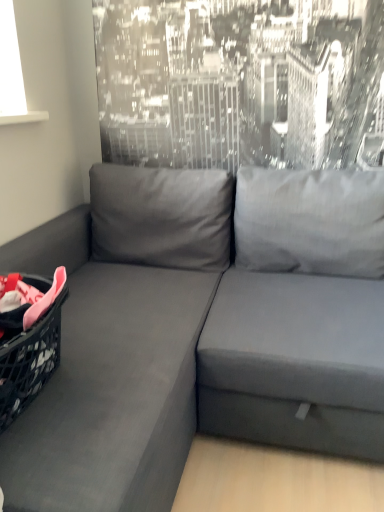
Locate an element on the screen. This screenshot has width=384, height=512. plastic black laundry basket at left is located at coordinates (29, 360).

What do you see at coordinates (29, 360) in the screenshot? I see `plastic black laundry basket at left` at bounding box center [29, 360].

What is the approximate width of suede gray couch at left?

It is 80.16 centimeters.

Measure the distance between suede gray couch at left and camera.

83.00 centimeters.

What do you see at coordinates (182, 348) in the screenshot? The image size is (384, 512). I see `suede gray couch at left` at bounding box center [182, 348].

Where is `suede gray couch at left`? suede gray couch at left is located at coordinates (182, 348).

Identify the location of plastic black laundry basket at left. (29, 360).

Which object is positioned more to the left, suede gray couch at left or plastic black laundry basket at left?

plastic black laundry basket at left.

Is suede gray couch at left further to camera compared to plastic black laundry basket at left?

No, suede gray couch at left is closer to the viewer.

Considering the positions of points (258, 298) and (19, 356), is point (258, 298) closer to camera compared to point (19, 356)?

No, (258, 298) is behind (19, 356).

From the image's perspective, is suede gray couch at left over plastic black laundry basket at left?

Incorrect, from the image's perspective, suede gray couch at left is lower than plastic black laundry basket at left.

From a real-world perspective, is suede gray couch at left positioned above or below plastic black laundry basket at left?

suede gray couch at left is below plastic black laundry basket at left.

Considering the sizes of objects suede gray couch at left and plastic black laundry basket at left in the image provided, who is wider, suede gray couch at left or plastic black laundry basket at left?

With larger width is suede gray couch at left.

Between suede gray couch at left and plastic black laundry basket at left, which one has more height?

suede gray couch at left.

Can you confirm if suede gray couch at left is smaller than plastic black laundry basket at left?

Actually, suede gray couch at left might be larger than plastic black laundry basket at left.

Is suede gray couch at left situated inside plastic black laundry basket at left or outside?

suede gray couch at left is not enclosed by plastic black laundry basket at left.

Are suede gray couch at left and plastic black laundry basket at left far apart?

No.

Could you tell me if suede gray couch at left is turned towards plastic black laundry basket at left?

Yes, suede gray couch at left is turned towards plastic black laundry basket at left.

The width and height of the screenshot is (384, 512). In order to click on basket lying on the left of suede gray couch at left in this screenshot , I will do `click(29, 360)`.

Would you say plastic black laundry basket at left is to the left or to the right of suede gray couch at left in the picture?

Clearly, plastic black laundry basket at left is on the left of suede gray couch at left in the image.

Considering the relative positions of plastic black laundry basket at left and suede gray couch at left in the image provided, is plastic black laundry basket at left behind suede gray couch at left?

That is True.

Is point (40, 284) farther from viewer compared to point (164, 358)?

No, it is in front of (164, 358).

From the image's perspective, which one is positioned higher, plastic black laundry basket at left or suede gray couch at left?

plastic black laundry basket at left appears higher in the image.

From a real-world perspective, is plastic black laundry basket at left on suede gray couch at left?

Correct, in the physical world, plastic black laundry basket at left is higher than suede gray couch at left.

Is plastic black laundry basket at left wider than suede gray couch at left?

In fact, plastic black laundry basket at left might be narrower than suede gray couch at left.

In terms of height, does plastic black laundry basket at left look taller or shorter compared to suede gray couch at left?

Clearly, plastic black laundry basket at left is shorter compared to suede gray couch at left.

In the scene shown: Does plastic black laundry basket at left have a larger size compared to suede gray couch at left?

No, plastic black laundry basket at left is not bigger than suede gray couch at left.

Can suede gray couch at left be found inside plastic black laundry basket at left?

That's incorrect, suede gray couch at left is not inside plastic black laundry basket at left.

Is plastic black laundry basket at left positioned far away from suede gray couch at left?

No, plastic black laundry basket at left is not far from suede gray couch at left.

Could you tell me if plastic black laundry basket at left is facing suede gray couch at left?

Yes, plastic black laundry basket at left is oriented towards suede gray couch at left.

In the image, there is a suede gray couch at left. Where is `basket above it (from the image's perspective)`? The width and height of the screenshot is (384, 512). basket above it (from the image's perspective) is located at coordinates (29, 360).

Where is `studio couch lying below the plastic black laundry basket at left (from the image's perspective)`? studio couch lying below the plastic black laundry basket at left (from the image's perspective) is located at coordinates click(182, 348).

This screenshot has width=384, height=512. Identify the location of basket that is above the suede gray couch at left (from a real-world perspective). (29, 360).